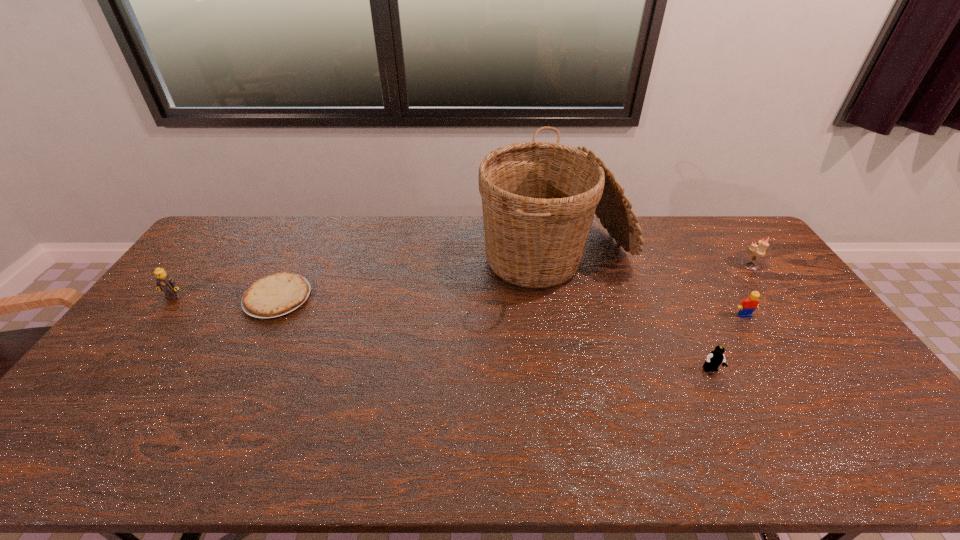
You are a GUI agent. You are given a task and a screenshot of the screen. Output one action in this format:
    pyautogui.click(x=<x>, y=<y>)
    Task: Click on the tallest object
    The width and height of the screenshot is (960, 540).
    Given the screenshot: What is the action you would take?
    pyautogui.click(x=538, y=198)

This screenshot has width=960, height=540. Identify the location of basket. (538, 198).

You are a GUI agent. You are given a task and a screenshot of the screen. Output one action in this format:
    pyautogui.click(x=<x>, y=<y>)
    Task: Click on the candle holder
    
    Given the screenshot: What is the action you would take?
    pyautogui.click(x=759, y=250)

This screenshot has width=960, height=540. What are the coordinates of `the leftmost Lego` in the screenshot? It's located at (164, 282).

Locate an element on the screen. This screenshot has height=540, width=960. the tallest Lego is located at coordinates (164, 282).

Image resolution: width=960 pixels, height=540 pixels. Identify the location of the second nearest Lego. (747, 306).

Find the location of a particular element. the fifth object from left to right is located at coordinates (747, 306).

Image resolution: width=960 pixels, height=540 pixels. In order to click on the nearest Lego in this screenshot , I will do `click(715, 358)`.

In order to click on the third object from right to left in this screenshot , I will do `click(715, 358)`.

Locate an element on the screen. This screenshot has height=540, width=960. the shortest object is located at coordinates (275, 295).